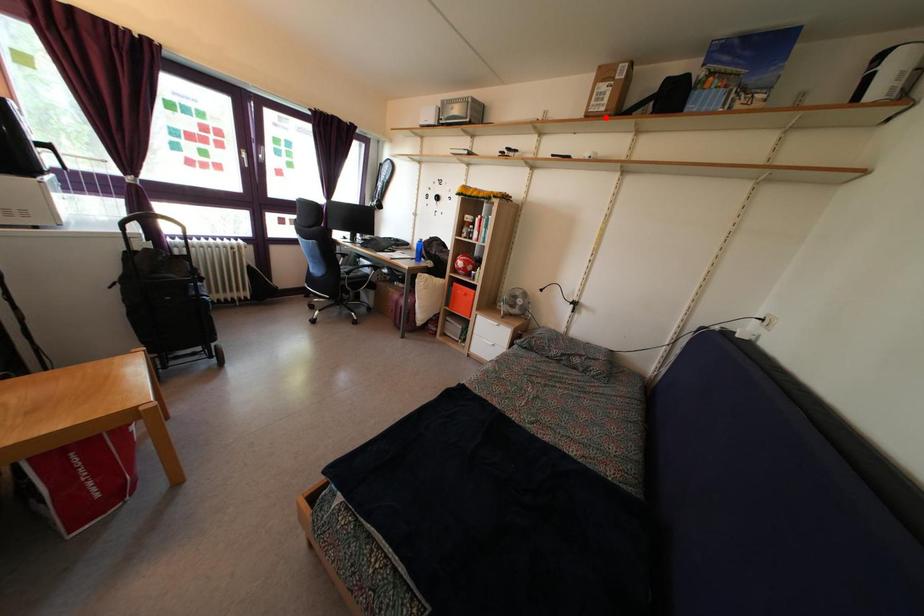
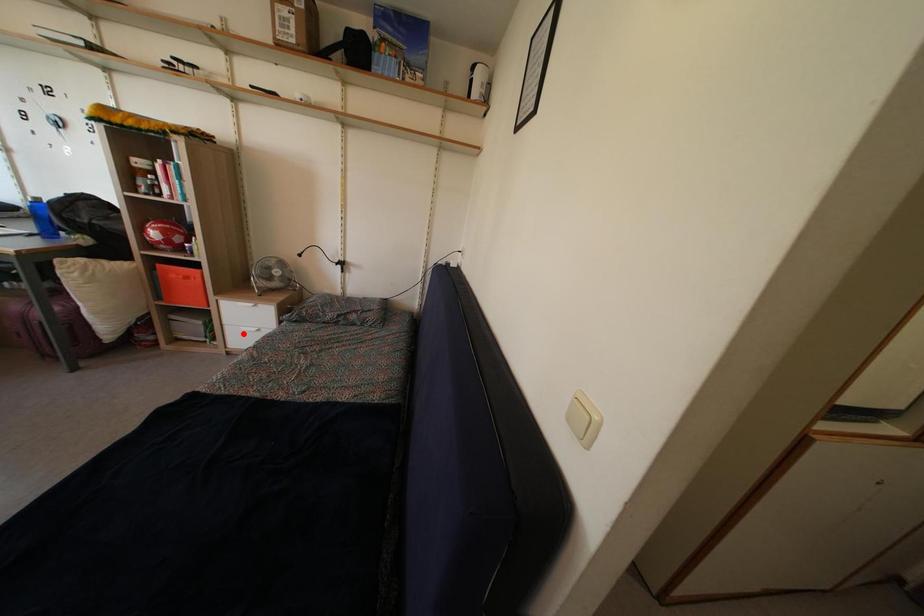
I am providing you with two images of the same scene from different viewpoints. A red point is marked on the first image and another point is marked on the second image. Do the highlighted points in image1 and image2 indicate the same real-world spot?

No